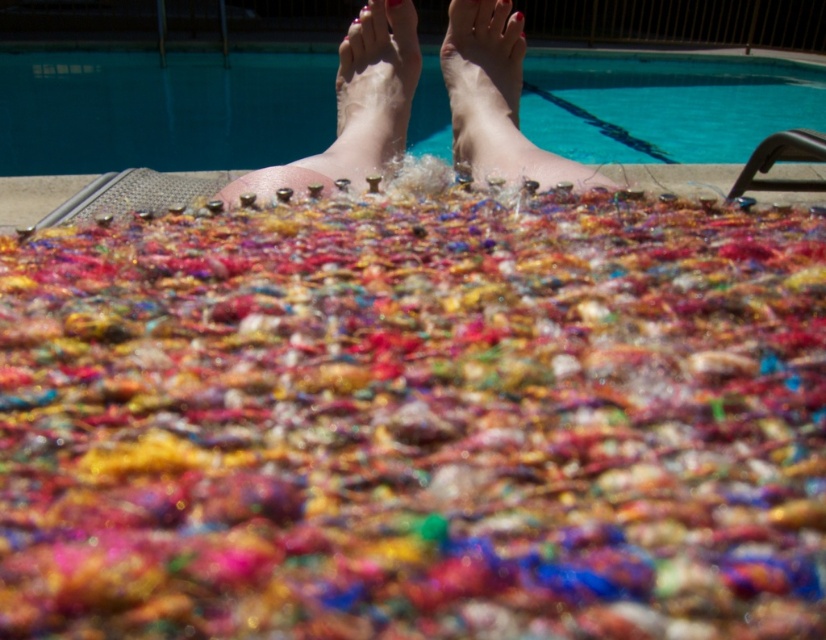
You are a lifeguard standing at the edge of the pool. You notice the blue glossy water at upper center and the nail polish feet at upper center. How far apart are these two objects?

The blue glossy water at upper center and the nail polish feet at upper center are 19.18 feet apart from each other.

You are a photographer adjusting your camera to focus on two points in the image. The first point is at coordinates point (387,8) and the second is at point (345,173). Which point is closer to your camera lens?

Point (387,8) is further to the camera than point (345,173), so the point closer to the camera lens is point (345,173).